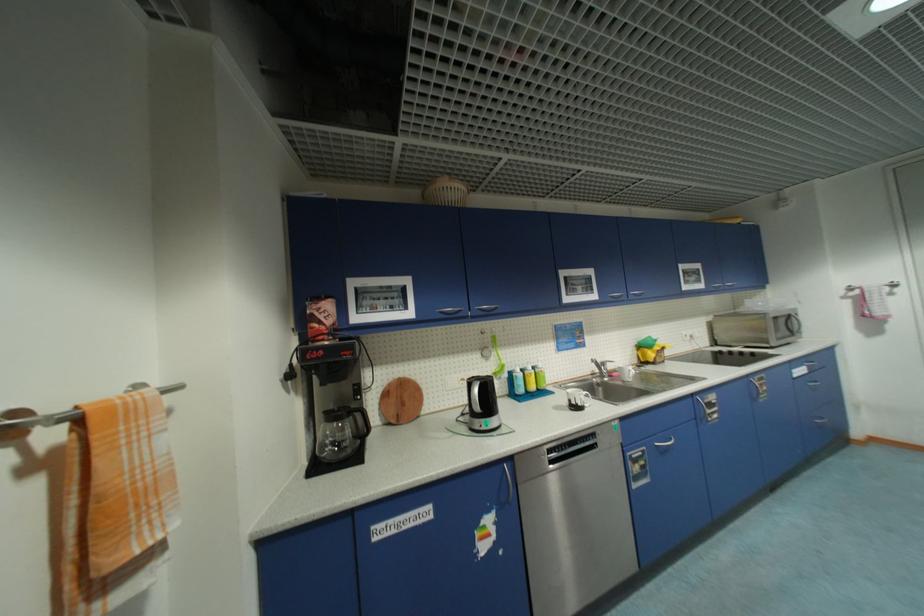
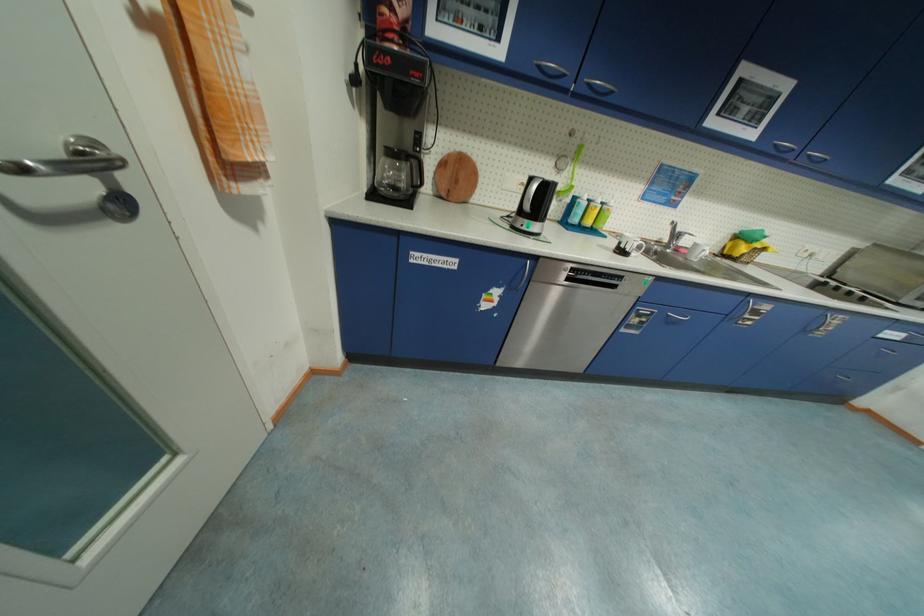
In the second image, find the point that corresponds to pixel 520 376 in the first image.

(584, 201)